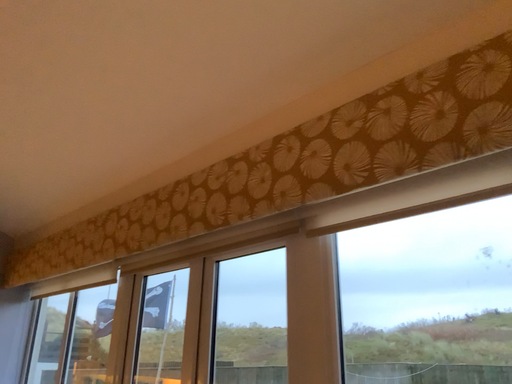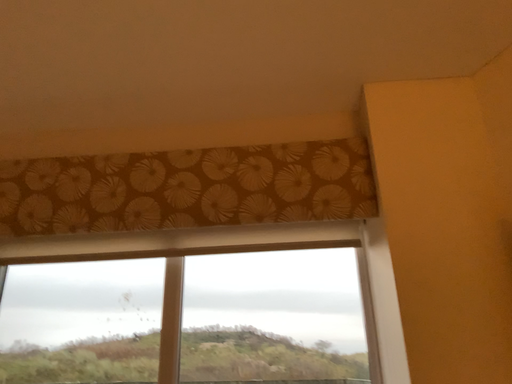
Question: How did the camera likely rotate when shooting the video?

Choices:
 (A) rotated right
 (B) rotated left

Answer: (A)